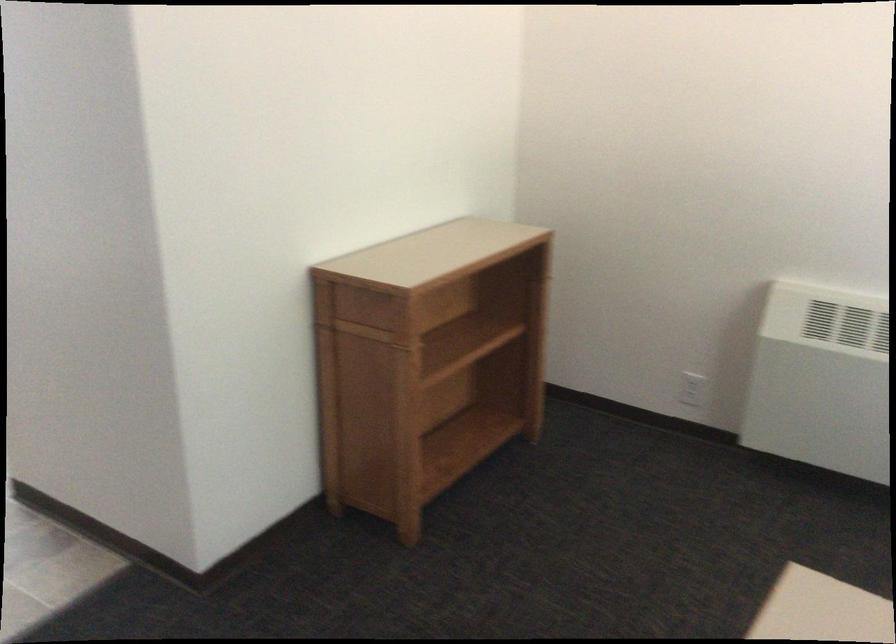
Find where to plugg the white power outlet. Please return your answer as a coordinate pair (x, y).

(692, 389)